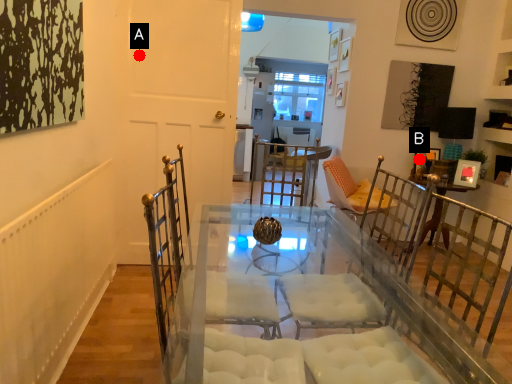
Question: Two points are circled on the image, labeled by A and B beside each circle. Among these points, which one is farthest from the camera?

Choices:
 (A) A is further
 (B) B is further

Answer: (B)